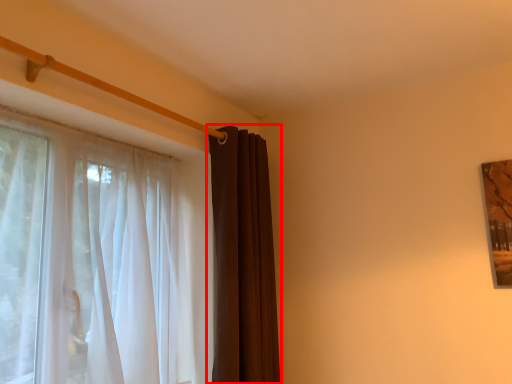
Question: From the image's perspective, where is curtain (annotated by the red box) located relative to curtain?

Choices:
 (A) above
 (B) below

Answer: (B)